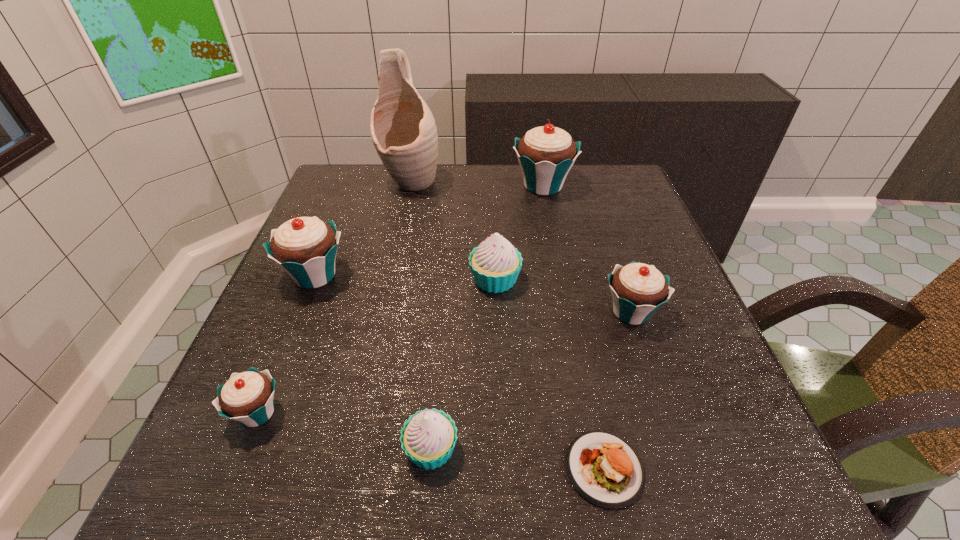
This screenshot has height=540, width=960. In order to click on vacant point located between the smallest teal cupcake and the third biggest teal cupcake in this screenshot , I will do tap(444, 362).

The width and height of the screenshot is (960, 540). I want to click on free space between the pitcher and the second smallest teal cupcake, so click(x=521, y=247).

Locate which object is the seventh closest to the shortest object. Please provide its 2D coordinates. Your answer should be formatted as a tuple, i.e. [(x, y)], where the tuple contains the x and y coordinates of a point satisfying the conditions above.

[(403, 130)]

The image size is (960, 540). Find the location of `object identified as the third closest to the second smallest teal cupcake`. object identified as the third closest to the second smallest teal cupcake is located at coordinates (546, 154).

Identify which cupcake is located as the fifth nearest to the bigger white cupcake. Please provide its 2D coordinates. Your answer should be formatted as a tuple, i.e. [(x, y)], where the tuple contains the x and y coordinates of a point satisfying the conditions above.

[(247, 397)]

Point out which cupcake is positioned as the second nearest to the shortest object. Please provide its 2D coordinates. Your answer should be formatted as a tuple, i.e. [(x, y)], where the tuple contains the x and y coordinates of a point satisfying the conditions above.

[(638, 290)]

Find the location of `the second closest teal cupcake relative to the third tallest object`. the second closest teal cupcake relative to the third tallest object is located at coordinates (546, 154).

At what (x,y) coordinates should I click in order to perform the action: click on the second closest teal cupcake to the smaller white cupcake. Please return your answer as a coordinate pair (x, y). Looking at the image, I should click on (305, 248).

The image size is (960, 540). I want to click on free spot that satisfies the following two spatial constraints: 1. on the back side of the second tallest object; 2. on the right side of the smallest teal cupcake, so click(x=349, y=186).

Where is `vacant area in the image that satisfies the following two spatial constraints: 1. at the spout of the farthest teal cupcake; 2. on the left side of the tallest object`? vacant area in the image that satisfies the following two spatial constraints: 1. at the spout of the farthest teal cupcake; 2. on the left side of the tallest object is located at coordinates (410, 186).